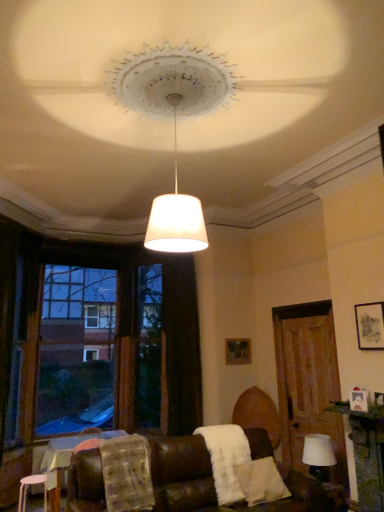
Question: Looking at their shapes, would you say brown wooden window frame at left is wider or thinner than white matte stool at lower left?

Choices:
 (A) thin
 (B) wide

Answer: (B)

Question: Does point (115, 314) appear closer or farther from the camera than point (26, 480)?

Choices:
 (A) farther
 (B) closer

Answer: (A)

Question: Considering the real-world distances, which object is closest to the wooden door at right?

Choices:
 (A) brown wooden window frame at left
 (B) white fabric lampshade at lower right
 (C) white fluffy blanket at lower center, acting as the 1th blanket starting from the right
 (D) matte black picture frame at upper right, arranged as the second picture frame when viewed from the left
 (E) black velvet curtain at center

Answer: (B)

Question: Based on their relative distances, which object is farther from the matte black picture frame at upper right, arranged as the second picture frame when viewed from the left?

Choices:
 (A) wooden textured table at lower left
 (B) woven beige blanket at lower left, which is the first blanket from left to right
 (C) white matte stool at lower left
 (D) white fluffy blanket at lower center, which is the 2th blanket from left to right
 (E) wooden door at right

Answer: (C)